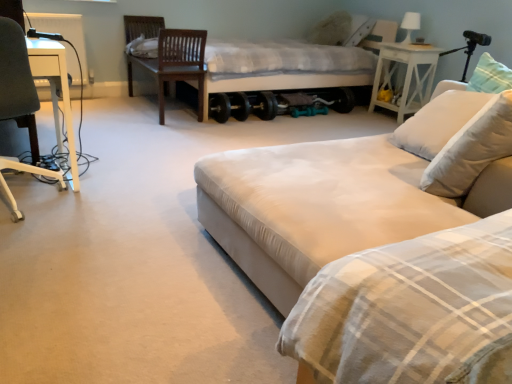
This screenshot has width=512, height=384. What are the coordinates of `free location in front of white fabric bed at center, which is counted as the first bed, starting from the top` in the screenshot? It's located at (215, 140).